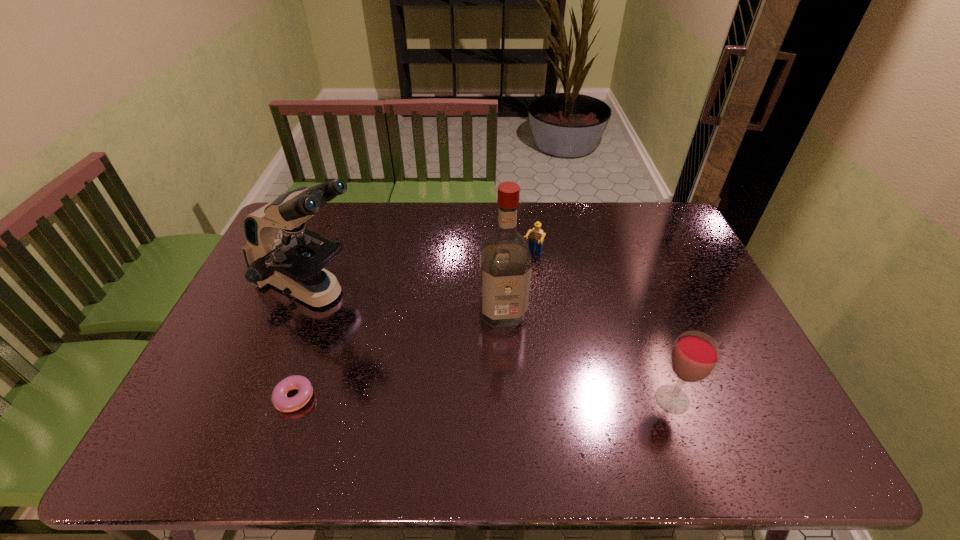
The image size is (960, 540). Find the location of `free space located on the face of the Lego`. free space located on the face of the Lego is located at coordinates pyautogui.click(x=515, y=289).

Find the location of `vacant space located 0.310m on the face of the Lego`. vacant space located 0.310m on the face of the Lego is located at coordinates (493, 328).

The height and width of the screenshot is (540, 960). Identify the location of vacant region located on the front-facing side of the liquor. (x=508, y=343).

Find the location of `vacant space located on the front-facing side of the liquor`. vacant space located on the front-facing side of the liquor is located at coordinates (509, 346).

You are a GUI agent. You are given a task and a screenshot of the screen. Output one action in this format:
    pyautogui.click(x=<x>, y=<y>)
    Task: Click on the vacant space located on the front-facing side of the liquor
    
    Given the screenshot: What is the action you would take?
    pyautogui.click(x=510, y=349)

Identify the location of vacant space located 0.070m through the eyepieces of the microscope. (381, 318).

The height and width of the screenshot is (540, 960). I want to click on vacant area situated through the eyepieces of the microscope, so click(450, 353).

Identify the location of vacant area located 0.050m through the eyepieces of the microscope. [x=375, y=315].

In order to click on doughnut that is at the near edge in this screenshot , I will do `click(281, 402)`.

Locate an element on the screen. This screenshot has width=960, height=540. wineglass located in the near edge section of the desktop is located at coordinates (695, 355).